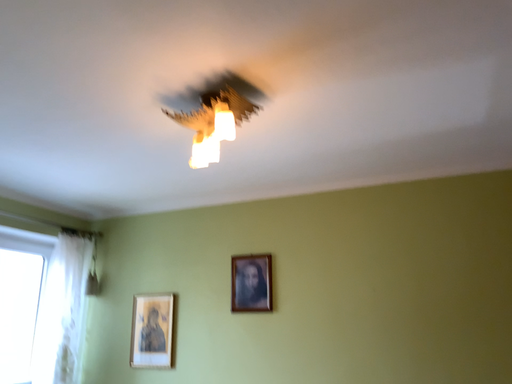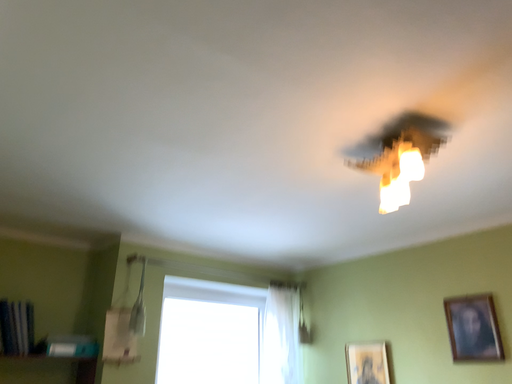
Question: How did the camera likely rotate when shooting the video?

Choices:
 (A) rotated left
 (B) rotated right

Answer: (A)